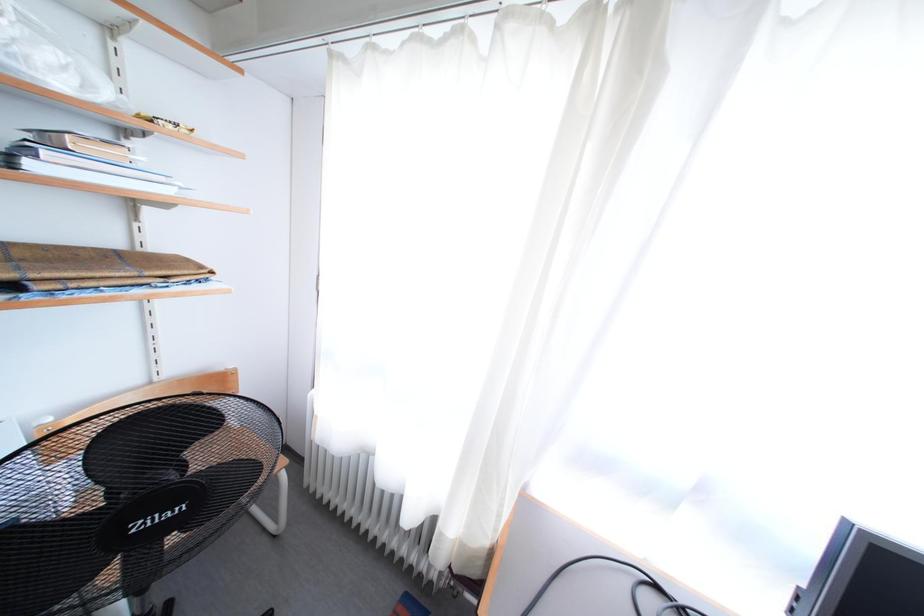
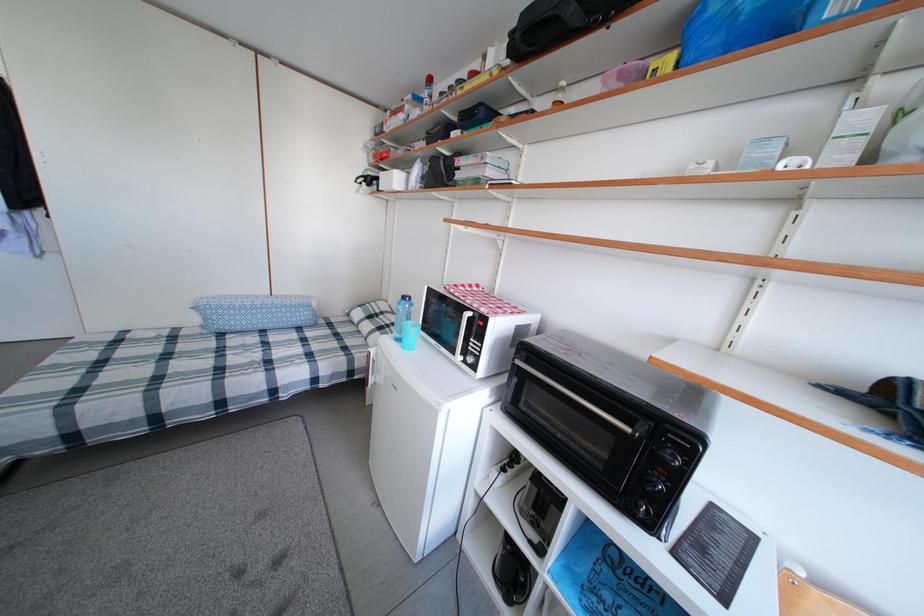
Question: How did the camera likely rotate?

Choices:
 (A) Left
 (B) Right
 (C) Up
 (D) Down

Answer: (A)